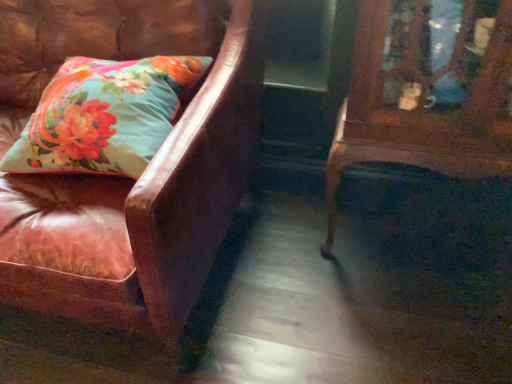
Question: Does leather couch at left appear on the right side of floral fabric pillow at left?

Choices:
 (A) no
 (B) yes

Answer: (A)

Question: Is leather couch at left smaller than floral fabric pillow at left?

Choices:
 (A) yes
 (B) no

Answer: (B)

Question: Can you confirm if leather couch at left is wider than floral fabric pillow at left?

Choices:
 (A) no
 (B) yes

Answer: (B)

Question: Is leather couch at left positioned behind floral fabric pillow at left?

Choices:
 (A) no
 (B) yes

Answer: (A)

Question: From the image's perspective, does leather couch at left appear lower than floral fabric pillow at left?

Choices:
 (A) yes
 (B) no

Answer: (A)

Question: Visually, is mahogany wood side table at right positioned to the left or to the right of floral fabric pillow at left?

Choices:
 (A) right
 (B) left

Answer: (A)

Question: Is mahogany wood side table at right bigger or smaller than floral fabric pillow at left?

Choices:
 (A) big
 (B) small

Answer: (A)

Question: Relative to floral fabric pillow at left, is mahogany wood side table at right in front or behind?

Choices:
 (A) front
 (B) behind

Answer: (A)

Question: Looking at their shapes, would you say mahogany wood side table at right is wider or thinner than floral fabric pillow at left?

Choices:
 (A) thin
 (B) wide

Answer: (A)

Question: In terms of height, does leather couch at left look taller or shorter compared to floral fabric pillow at left?

Choices:
 (A) tall
 (B) short

Answer: (A)

Question: From a real-world perspective, relative to floral fabric pillow at left, is leather couch at left vertically above or below?

Choices:
 (A) above
 (B) below

Answer: (B)

Question: Is leather couch at left in front of or behind floral fabric pillow at left in the image?

Choices:
 (A) behind
 (B) front

Answer: (B)

Question: Considering the relative positions of leather couch at left and floral fabric pillow at left in the image provided, is leather couch at left to the left or to the right of floral fabric pillow at left?

Choices:
 (A) left
 (B) right

Answer: (A)

Question: Considering the positions of point (212, 165) and point (334, 160), is point (212, 165) closer or farther from the camera than point (334, 160)?

Choices:
 (A) farther
 (B) closer

Answer: (B)

Question: From a real-world perspective, is leather couch at left physically located above or below mahogany wood side table at right?

Choices:
 (A) below
 (B) above

Answer: (B)